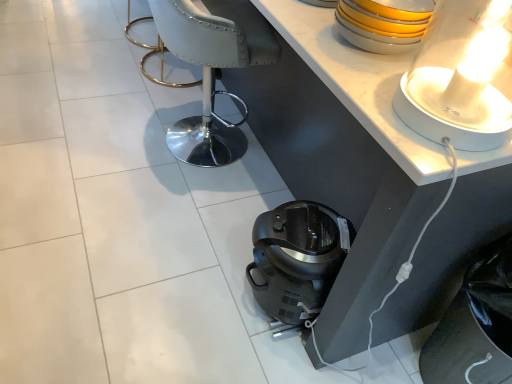
What do you see at coordinates (460, 77) in the screenshot?
I see `white glossy lamp at upper right` at bounding box center [460, 77].

This screenshot has height=384, width=512. I want to click on yellow glossy bowls at upper right, so click(384, 23).

Where is `table on the left of satin black coffee maker at lower center`? Image resolution: width=512 pixels, height=384 pixels. table on the left of satin black coffee maker at lower center is located at coordinates (359, 85).

Is white glossy table at upper center far from satin black coffee maker at lower center?

They are positioned close to each other.

Does white glossy table at upper center have a lesser width compared to satin black coffee maker at lower center?

Incorrect, the width of white glossy table at upper center is not less than that of satin black coffee maker at lower center.

From a real-world perspective, is white glossy table at upper center above or below satin black coffee maker at lower center?

Clearly, from a real-world perspective, white glossy table at upper center is below satin black coffee maker at lower center.

Where is `lamp below the white leather armchair at center (from the image's perspective)`? This screenshot has height=384, width=512. lamp below the white leather armchair at center (from the image's perspective) is located at coordinates (460, 77).

Would you consider white leather armchair at center to be distant from white glossy lamp at upper right?

white leather armchair at center is positioned a significant distance from white glossy lamp at upper right.

From a real-world perspective, which is physically below, white leather armchair at center or white glossy lamp at upper right?

white leather armchair at center.

Is point (248, 53) closer or farther from the camera than point (460, 136)?

Point (248, 53).

Based on the photo, would you say white leather armchair at center is outside white glossy table at upper center?

That's correct, white leather armchair at center is outside of white glossy table at upper center.

Is white leather armchair at center oriented away from white glossy table at upper center?

No, white leather armchair at center is not facing the opposite direction of white glossy table at upper center.

Can you tell me how much white leather armchair at center and white glossy table at upper center differ in facing direction?

2.58 degrees separate the facing orientations of white leather armchair at center and white glossy table at upper center.

Between white leather armchair at center and white glossy table at upper center, which one is positioned in front?

white glossy table at upper center is closer to the camera.

From the image's perspective, is white glossy lamp at upper right positioned above or below white leather armchair at center?

From the image's perspective, white glossy lamp at upper right appears below white leather armchair at center.

Between point (423, 87) and point (186, 54), which one is positioned in front?

The point (423, 87) is more forward.

Is white glossy table at upper center facing towards white glossy lamp at upper right?

No, white glossy table at upper center is not facing towards white glossy lamp at upper right.

From the image's perspective, relative to white glossy lamp at upper right, is white glossy table at upper center above or below?

white glossy table at upper center is situated higher than white glossy lamp at upper right in the image.

Considering the relative sizes of white glossy table at upper center and white glossy lamp at upper right in the image provided, is white glossy table at upper center bigger than white glossy lamp at upper right?

Yes.

In the scene shown: Considering the sizes of objects white leather armchair at center and yellow glossy bowls at upper right in the image provided, who is thinner, white leather armchair at center or yellow glossy bowls at upper right?

yellow glossy bowls at upper right is thinner.

This screenshot has height=384, width=512. Identify the location of appliance in front of the white leather armchair at center. (384, 23).

Can you confirm if white leather armchair at center is smaller than yellow glossy bowls at upper right?

Actually, white leather armchair at center might be larger than yellow glossy bowls at upper right.

Looking at this image, in terms of height, does white glossy lamp at upper right look taller or shorter compared to white glossy table at upper center?

Clearly, white glossy lamp at upper right is taller compared to white glossy table at upper center.

Identify the location of table behind the white glossy lamp at upper right. (359, 85).

Based on the photo, is white glossy lamp at upper right placed right next to white glossy table at upper center?

No, white glossy lamp at upper right is not beside white glossy table at upper center.

Who is bigger, white glossy lamp at upper right or white glossy table at upper center?

white glossy table at upper center.

Identify the location of home appliance above the white glossy table at upper center (from a real-world perspective). The height and width of the screenshot is (384, 512). (297, 260).

Image resolution: width=512 pixels, height=384 pixels. Identify the location of armchair behind the white glossy lamp at upper right. [212, 72].

Based on their spatial positions, is yellow glossy bowls at upper right or satin black coffee maker at lower center further from white leather armchair at center?

yellow glossy bowls at upper right is positioned further to the anchor white leather armchair at center.

Looking at the image, which one is located further to white glossy table at upper center, yellow glossy bowls at upper right or satin black coffee maker at lower center?

Based on the image, satin black coffee maker at lower center appears to be further to white glossy table at upper center.

Based on their spatial positions, is white glossy table at upper center or white leather armchair at center further from yellow glossy bowls at upper right?

white leather armchair at center.

Which object lies further to the anchor point white glossy lamp at upper right, yellow glossy bowls at upper right or satin black coffee maker at lower center?

satin black coffee maker at lower center is further to white glossy lamp at upper right.

Looking at the image, which one is located further to satin black coffee maker at lower center, white glossy table at upper center or yellow glossy bowls at upper right?

Based on the image, yellow glossy bowls at upper right appears to be further to satin black coffee maker at lower center.

From the image, which object appears to be nearer to yellow glossy bowls at upper right, white glossy lamp at upper right or white leather armchair at center?

Among the two, white glossy lamp at upper right is located nearer to yellow glossy bowls at upper right.

Estimate the real-world distances between objects in this image. Which object is further from white glossy table at upper center, white leather armchair at center or yellow glossy bowls at upper right?

white leather armchair at center lies further to white glossy table at upper center than the other object.

Based on their spatial positions, is satin black coffee maker at lower center or white leather armchair at center further from yellow glossy bowls at upper right?

Based on the image, white leather armchair at center appears to be further to yellow glossy bowls at upper right.

Find the location of `appliance between white leather armchair at center and satin black coffee maker at lower center vertically`. appliance between white leather armchair at center and satin black coffee maker at lower center vertically is located at coordinates (384, 23).

Find the location of a particular element. The height and width of the screenshot is (384, 512). lamp between white leather armchair at center and satin black coffee maker at lower center in the up-down direction is located at coordinates (460, 77).

I want to click on table that lies between white leather armchair at center and satin black coffee maker at lower center from top to bottom, so click(x=359, y=85).

You are a GUI agent. You are given a task and a screenshot of the screen. Output one action in this format:
    pyautogui.click(x=<x>, y=<y>)
    Task: Click on the appliance situated between white glossy table at upper center and white glossy lamp at upper right from left to right
    
    Given the screenshot: What is the action you would take?
    pyautogui.click(x=384, y=23)